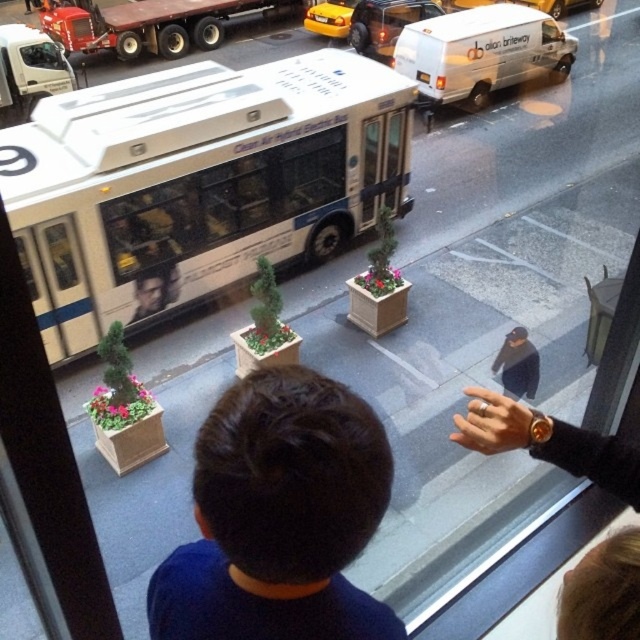
Who is positioned more to the right, white matte bus at center or white matte van at upper right?

white matte van at upper right

Who is more forward, (84, 188) or (493, 90)?

Point (84, 188)

The image size is (640, 640). In order to click on white matte bus at center in this screenshot , I will do `click(196, 182)`.

Who is more forward, (216, 627) or (525, 349)?

Point (216, 627) is in front.

Is dark blue shirt at center wider than dark blue jacket at center?

No, dark blue shirt at center is not wider than dark blue jacket at center.

Does point (384, 506) lie in front of point (516, 388)?

Yes, point (384, 506) is closer to viewer.

The width and height of the screenshot is (640, 640). In order to click on dark blue shirt at center in this screenshot , I will do `click(280, 516)`.

Is white matte bus at center to the right of yellow rubber taxi at upper center from the viewer's perspective?

Incorrect, white matte bus at center is not on the right side of yellow rubber taxi at upper center.

Is point (243, 184) positioned in front of point (324, 4)?

Yes, it is in front of point (324, 4).

Which is in front, point (224, 109) or point (320, 13)?

Point (224, 109) is in front.

The width and height of the screenshot is (640, 640). In order to click on white matte bus at center in this screenshot , I will do `click(196, 182)`.